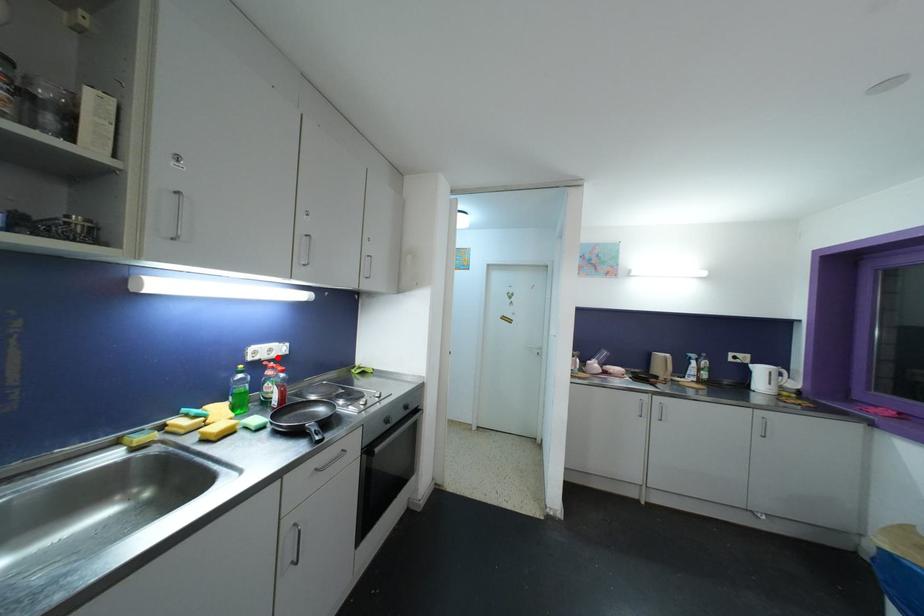
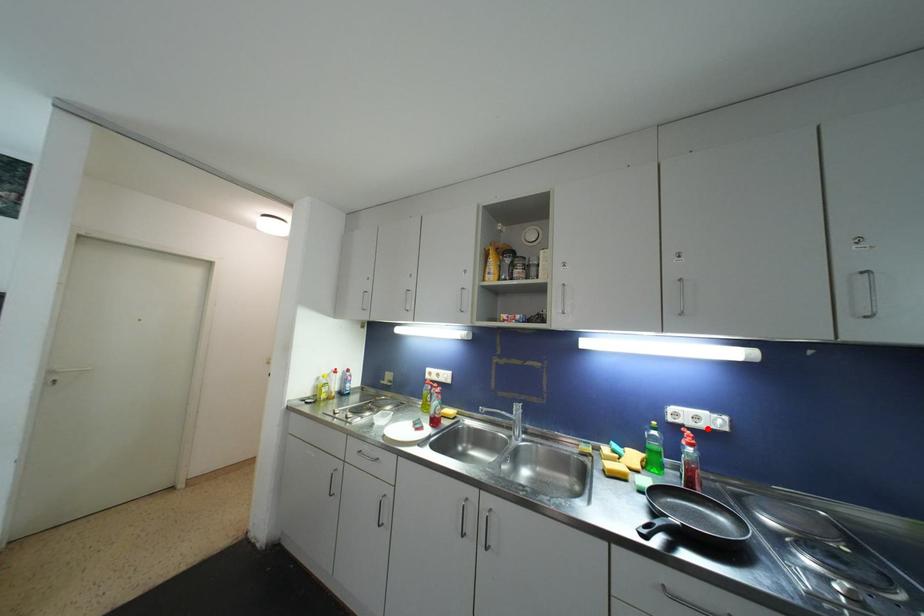
I am providing you with two images of the same scene from different viewpoints. A red point is marked on the first image and another point is marked on the second image. Is the red point in image1 aligned with the point shown in image2?

Yes